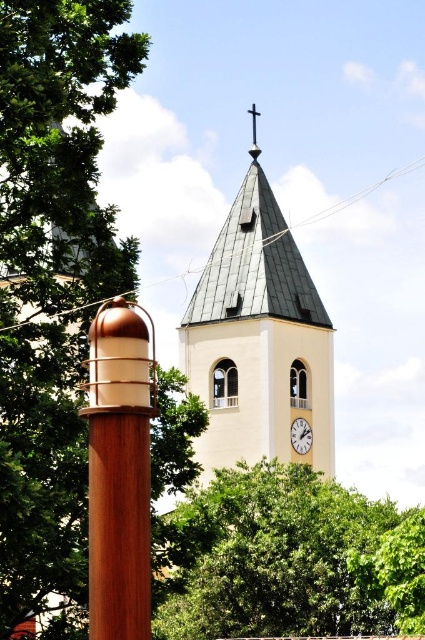
Based on the photo, you are standing in front of the church tower and want to take a photo that includes both the green leafy tree at upper left and the white matte clock at center. Which object should you focus on first to ensure both are in frame?

You should focus on the green leafy tree at upper left first because it is larger than the white matte clock at center, so ensuring it fits will help accommodate the smaller clock in the frame.

You are standing in front of the church tower and notice two points marked on the image. The first point is at coordinate point (98, 52) and the second is at point (309, 429). From your current position, which point is closer to you?

Point (98, 52) is in front of point (309, 429), so the first point is closer to you.

You are standing in front of the white smooth clock tower at center and want to take a photo of the green leafy tree at upper center behind it. Will the tree be fully visible in the photo, or will part of it be blocked by the tower?

The white smooth clock tower at center is further to the viewer than the green leafy tree at upper center, so the tree is closer to you. This means the tree will not be blocked by the tower and will be fully visible in the photo.